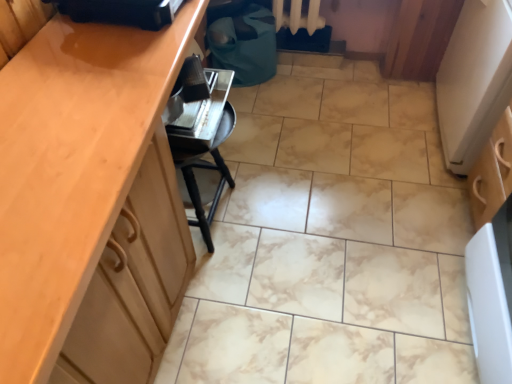
Question: Is white textured radiator at upper center not within matte wood cabinet at left?

Choices:
 (A) yes
 (B) no

Answer: (A)

Question: Can you confirm if white textured radiator at upper center is positioned to the right of matte wood cabinet at left?

Choices:
 (A) no
 (B) yes

Answer: (B)

Question: Does white textured radiator at upper center have a greater height compared to matte wood cabinet at left?

Choices:
 (A) no
 (B) yes

Answer: (A)

Question: Is white textured radiator at upper center positioned in front of matte wood cabinet at left?

Choices:
 (A) no
 (B) yes

Answer: (A)

Question: Can you confirm if white textured radiator at upper center is thinner than matte wood cabinet at left?

Choices:
 (A) no
 (B) yes

Answer: (B)

Question: Choose the correct answer: Is white textured radiator at upper center inside metallic silver toaster at lower center, the first appliance viewed from the back, or outside it?

Choices:
 (A) outside
 (B) inside

Answer: (A)

Question: Does point (317, 19) appear closer or farther from the camera than point (214, 82)?

Choices:
 (A) closer
 (B) farther

Answer: (B)

Question: Is white textured radiator at upper center to the left or to the right of metallic silver toaster at lower center, the 2th appliance when ordered from front to back, in the image?

Choices:
 (A) left
 (B) right

Answer: (B)

Question: In the image, is white textured radiator at upper center positioned in front of or behind metallic silver toaster at lower center, the 2th appliance when ordered from front to back?

Choices:
 (A) behind
 (B) front

Answer: (A)

Question: Does point (201, 125) appear closer or farther from the camera than point (159, 6)?

Choices:
 (A) closer
 (B) farther

Answer: (B)

Question: Is metallic silver toaster at lower center, the first appliance viewed from the back, in front of or behind black plastic bag at upper center, acting as the second appliance starting from the back, in the image?

Choices:
 (A) front
 (B) behind

Answer: (B)

Question: Is metallic silver toaster at lower center, the first appliance viewed from the back, wider or thinner than black plastic bag at upper center, acting as the second appliance starting from the back?

Choices:
 (A) thin
 (B) wide

Answer: (A)

Question: Is metallic silver toaster at lower center, the 2th appliance when ordered from front to back, to the left or to the right of black plastic bag at upper center, the 1th appliance when ordered from front to back, in the image?

Choices:
 (A) right
 (B) left

Answer: (A)

Question: Considering the positions of white textured radiator at upper center and matte wood cabinet at left in the image, is white textured radiator at upper center taller or shorter than matte wood cabinet at left?

Choices:
 (A) short
 (B) tall

Answer: (A)

Question: Looking at their shapes, would you say white textured radiator at upper center is wider or thinner than matte wood cabinet at left?

Choices:
 (A) thin
 (B) wide

Answer: (A)